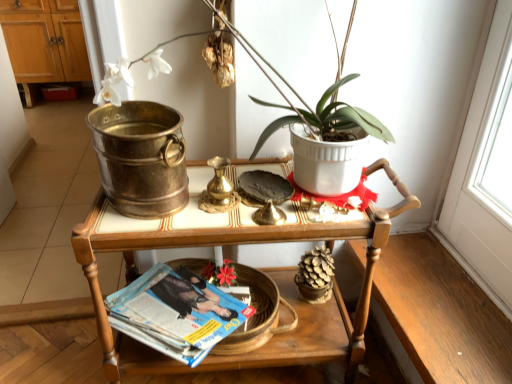
Question: From a real-world perspective, is blue glossy magazine at lower center positioned over wooden tray at center based on gravity?

Choices:
 (A) yes
 (B) no

Answer: (B)

Question: Does blue glossy magazine at lower center appear on the right side of wooden tray at center?

Choices:
 (A) yes
 (B) no

Answer: (B)

Question: Does blue glossy magazine at lower center have a greater height compared to wooden tray at center?

Choices:
 (A) yes
 (B) no

Answer: (B)

Question: Does blue glossy magazine at lower center turn towards wooden tray at center?

Choices:
 (A) no
 (B) yes

Answer: (B)

Question: From the image's perspective, is blue glossy magazine at lower center beneath wooden tray at center?

Choices:
 (A) yes
 (B) no

Answer: (A)

Question: From the image's perspective, is blue glossy magazine at lower center above wooden tray at center?

Choices:
 (A) no
 (B) yes

Answer: (A)

Question: Is blue glossy magazine at lower center a part of brushed metal bucket at upper left?

Choices:
 (A) yes
 (B) no

Answer: (B)

Question: Is brushed metal bucket at upper left positioned before blue glossy magazine at lower center?

Choices:
 (A) yes
 (B) no

Answer: (B)

Question: From the image's perspective, is brushed metal bucket at upper left below blue glossy magazine at lower center?

Choices:
 (A) yes
 (B) no

Answer: (B)

Question: From a real-world perspective, does brushed metal bucket at upper left sit lower than blue glossy magazine at lower center?

Choices:
 (A) yes
 (B) no

Answer: (B)

Question: Is brushed metal bucket at upper left completely or partially outside of blue glossy magazine at lower center?

Choices:
 (A) yes
 (B) no

Answer: (A)

Question: From a real-world perspective, is brushed metal bucket at upper left over blue glossy magazine at lower center?

Choices:
 (A) no
 (B) yes

Answer: (B)

Question: Is white ceramic pot at upper center not close to wooden tray at center?

Choices:
 (A) yes
 (B) no

Answer: (B)